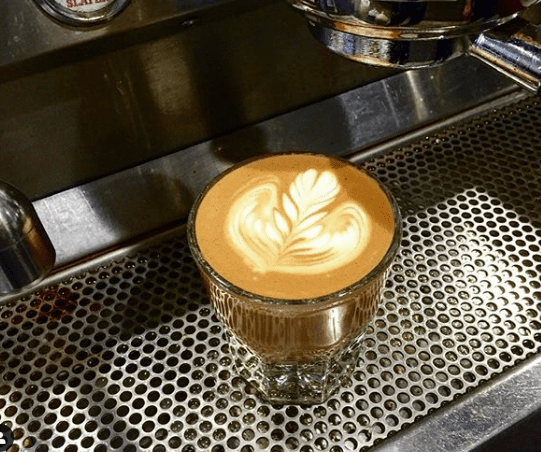
At what (x,y) coordinates should I click in order to perform the action: click on cappucino maker. Please return your answer as a coordinate pair (x, y). The image size is (541, 452). Looking at the image, I should click on (266, 82), (361, 34), (181, 139).